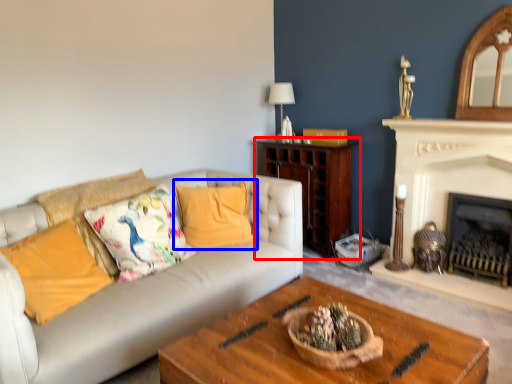
Question: Which point is closer to the camera, cabinetry (highlighted by a red box) or pillow (highlighted by a blue box)?

Choices:
 (A) cabinetry
 (B) pillow

Answer: (B)